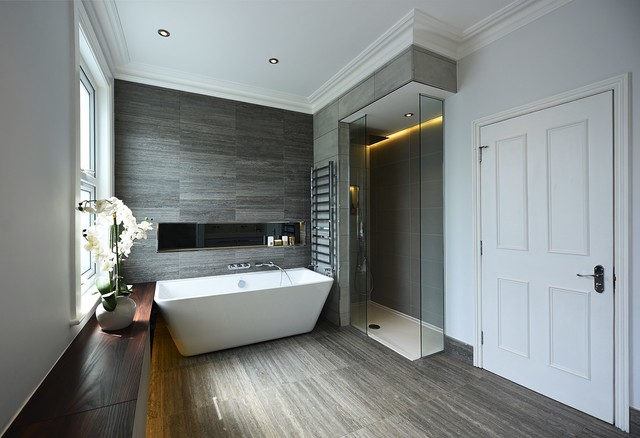
Where is `glass in shower`? This screenshot has width=640, height=438. glass in shower is located at coordinates (353, 236), (434, 253).